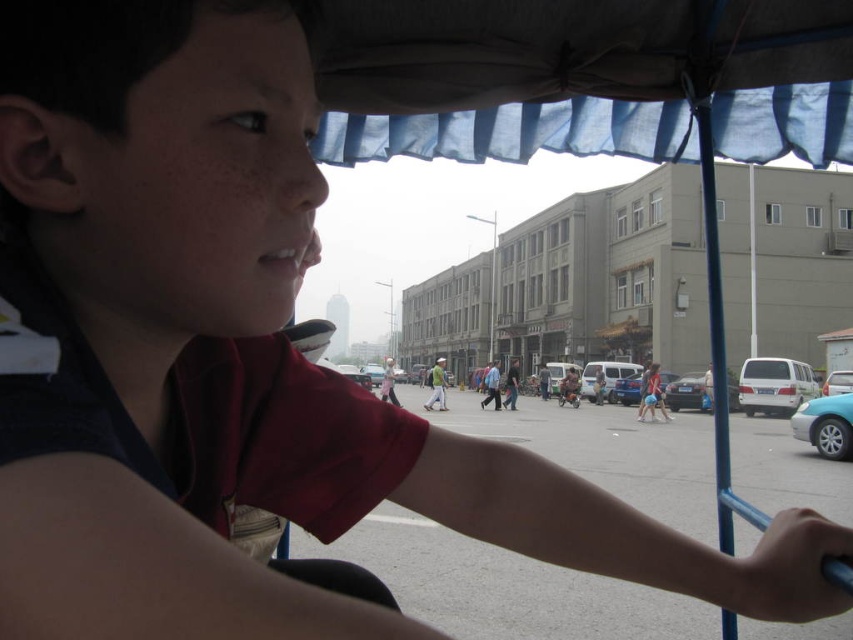
Can you confirm if blue metallic car at center is bigger than light blue shirt at center?

No.

Which is more to the right, blue metallic car at center or light blue shirt at center?

blue metallic car at center

Is point (630, 396) positioned in front of point (389, 358)?

No, it is behind (389, 358).

Identify the location of blue metallic car at center. (628, 388).

Between blue fabric canopy at upper center and metallic silver sedan at lower right, which one appears on the right side from the viewer's perspective?

metallic silver sedan at lower right is more to the right.

Between blue fabric canopy at upper center and metallic silver sedan at lower right, which one has more height?

blue fabric canopy at upper center is taller.

Which is behind, point (579, 120) or point (840, 444)?

Positioned behind is point (840, 444).

Where is `blue fabric canopy at upper center`? The image size is (853, 640). blue fabric canopy at upper center is located at coordinates (584, 77).

Between green fabric shirt at center and light blue shirt at center, which one is positioned lower?

green fabric shirt at center is below.

Where is `green fabric shirt at center`? green fabric shirt at center is located at coordinates (436, 385).

Does point (440, 356) lie behind point (386, 364)?

That is True.

Where is `green fabric shirt at center`? This screenshot has height=640, width=853. green fabric shirt at center is located at coordinates (436, 385).